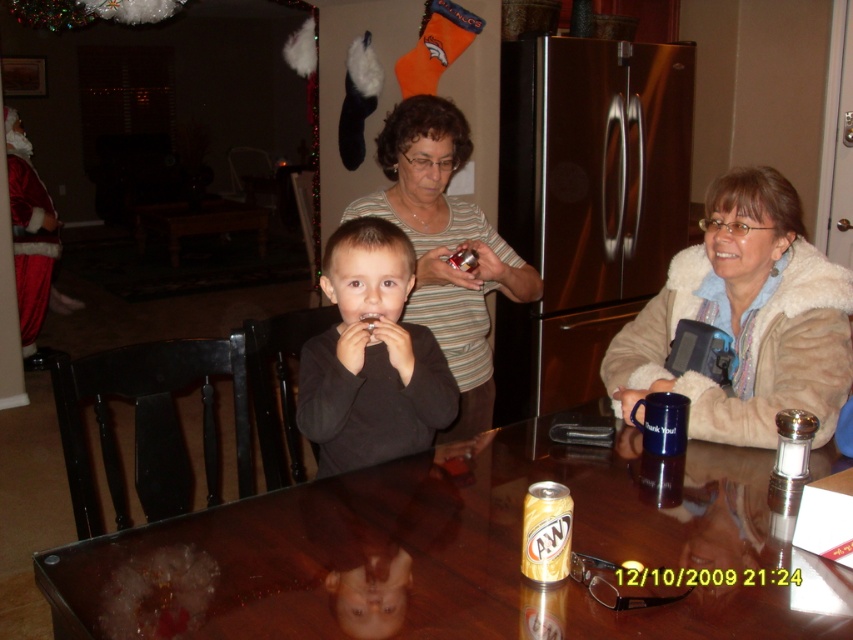
Can you confirm if glossy brown table at center is smaller than gold metallic can at center?

No, glossy brown table at center is not smaller than gold metallic can at center.

Is point (115, 609) positioned behind point (550, 522)?

No.

At what (x,y) coordinates should I click in order to perform the action: click on glossy brown table at center. Please return your answer as a coordinate pair (x, y). The image size is (853, 640). Looking at the image, I should click on (459, 554).

In the scene shown: Who is positioned more to the right, glossy brown table at center or black matte shirt at center?

From the viewer's perspective, glossy brown table at center appears more on the right side.

Between glossy brown table at center and black matte shirt at center, which one has less height?

glossy brown table at center is shorter.

Locate an element on the screen. glossy brown table at center is located at coordinates (459, 554).

Where is `glossy brown table at center`? The width and height of the screenshot is (853, 640). glossy brown table at center is located at coordinates (459, 554).

Is point (167, 573) closer to camera compared to point (461, 403)?

Yes, it is.

Is glossy brown table at center positioned at the back of striped knit sweater at center?

No, it is not.

Where is `glossy brown table at center`? This screenshot has width=853, height=640. glossy brown table at center is located at coordinates (459, 554).